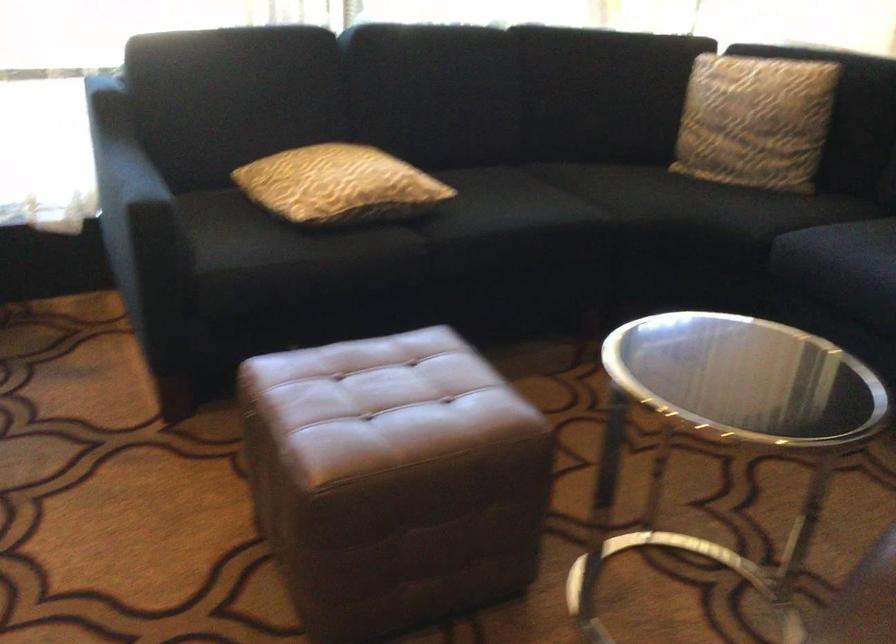
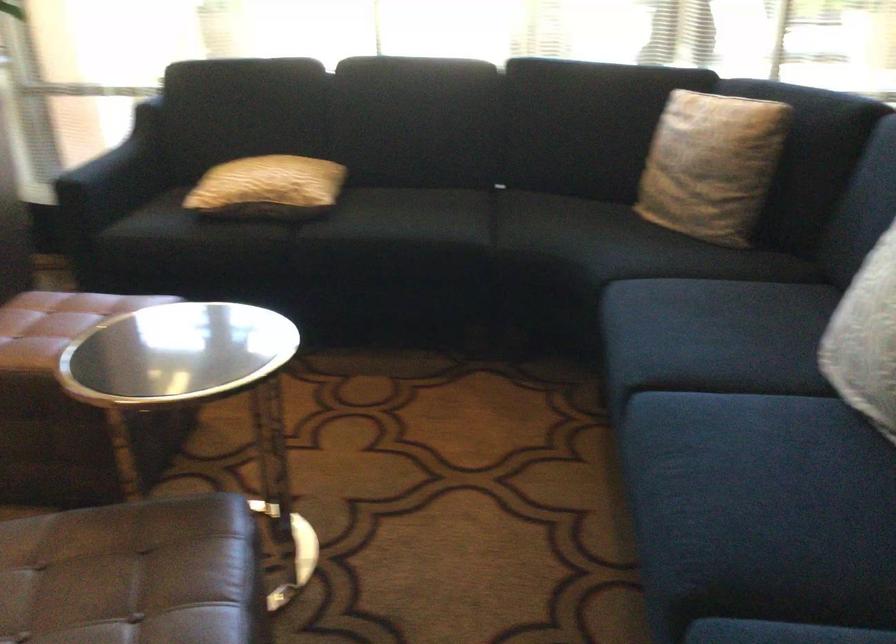
Where in the second image is the point corresponding to [169,199] from the first image?

(115, 176)